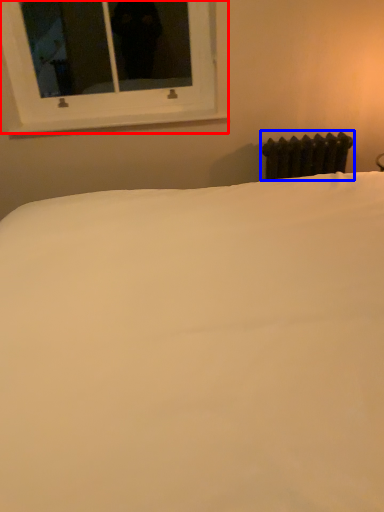
Question: Among these objects, which one is farthest to the camera, window (highlighted by a red box) or radiator (highlighted by a blue box)?

Choices:
 (A) window
 (B) radiator

Answer: (B)